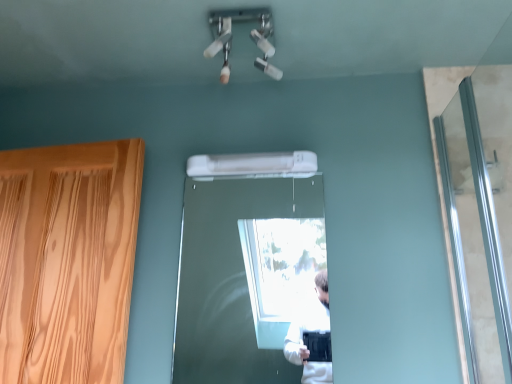
The image size is (512, 384). In order to click on silver metallic screen door at right in this screenshot , I will do `click(481, 215)`.

What do you see at coordinates (244, 275) in the screenshot? Image resolution: width=512 pixels, height=384 pixels. I see `wooden door at center` at bounding box center [244, 275].

What is the approximate height of white plastic air conditioner at center?

3.95 inches.

You are a GUI agent. You are given a task and a screenshot of the screen. Output one action in this format:
    pyautogui.click(x=<x>, y=<y>)
    Task: Click on the white plastic air conditioner at center
    The width and height of the screenshot is (512, 384).
    Given the screenshot: What is the action you would take?
    pyautogui.click(x=253, y=165)

The image size is (512, 384). In order to click on silver metallic screen door at right in this screenshot , I will do `click(481, 215)`.

Find the location of a particular element. The width and height of the screenshot is (512, 384). air conditioner above the silver metallic screen door at right (from the image's perspective) is located at coordinates (253, 165).

Is silver metallic screen door at right to the left of white plastic air conditioner at center from the viewer's perspective?

In fact, silver metallic screen door at right is to the right of white plastic air conditioner at center.

Does point (482, 123) come in front of point (282, 174)?

Yes, it is.

Can you confirm if silver metallic screen door at right is shorter than white plastic air conditioner at center?

Incorrect, the height of silver metallic screen door at right does not fall short of that of white plastic air conditioner at center.

Consider the image. How many degrees apart are the facing directions of white plastic air conditioner at center and silver metallic screen door at right?

There is a 88.9-degree angle between the facing directions of white plastic air conditioner at center and silver metallic screen door at right.

Consider the image. Which is correct: white plastic air conditioner at center is inside silver metallic screen door at right, or outside of it?

white plastic air conditioner at center is outside silver metallic screen door at right.

How distant is white plastic air conditioner at center from silver metallic screen door at right?

white plastic air conditioner at center is 25.09 inches away from silver metallic screen door at right.

Considering the relative sizes of white plastic air conditioner at center and silver metallic screen door at right in the image provided, is white plastic air conditioner at center thinner than silver metallic screen door at right?

No.

Is point (273, 201) less distant than point (202, 162)?

No, it is behind (202, 162).

Considering their positions, is wooden door at center located in front of or behind white plastic air conditioner at center?

Clearly, wooden door at center is in front of white plastic air conditioner at center.

Is wooden door at center facing away from white plastic air conditioner at center?

No, wooden door at center is not facing the opposite direction of white plastic air conditioner at center.

Can you confirm if wooden door at center is positioned to the right of white plastic air conditioner at center?

Yes, wooden door at center is to the right of white plastic air conditioner at center.

Is silver metallic screen door at right facing towards wooden door at center?

Yes, silver metallic screen door at right is facing wooden door at center.

From a real-world perspective, is silver metallic screen door at right physically above wooden door at center?

Correct, in the physical world, silver metallic screen door at right is higher than wooden door at center.

The width and height of the screenshot is (512, 384). I want to click on screen door positioned vertically above the wooden door at center (from a real-world perspective), so click(x=481, y=215).

Is silver metallic screen door at right wider than wooden door at center?

Indeed, silver metallic screen door at right has a greater width compared to wooden door at center.

Considering the positions of points (263, 166) and (255, 358), is point (263, 166) farther from camera compared to point (255, 358)?

No, it is in front of (255, 358).

From the image's perspective, between white plastic air conditioner at center and wooden door at center, which one is located above?

white plastic air conditioner at center is shown above in the image.

Looking at the image, does white plastic air conditioner at center seem bigger or smaller compared to wooden door at center?

Clearly, white plastic air conditioner at center is smaller in size than wooden door at center.

In terms of width, does white plastic air conditioner at center look wider or thinner when compared to wooden door at center?

white plastic air conditioner at center is wider than wooden door at center.

Is point (180, 257) less distant than point (449, 189)?

No, (180, 257) is behind (449, 189).

Where is `door directly beneath the silver metallic screen door at right (from a real-world perspective)`? The image size is (512, 384). door directly beneath the silver metallic screen door at right (from a real-world perspective) is located at coordinates (244, 275).

Is wooden door at center wider or thinner than silver metallic screen door at right?

wooden door at center is thinner than silver metallic screen door at right.

From a real-world perspective, is wooden door at center positioned above or below silver metallic screen door at right?

wooden door at center is situated lower than silver metallic screen door at right in the real world.

Locate an element on the screen. The image size is (512, 384). screen door below the white plastic air conditioner at center (from the image's perspective) is located at coordinates (481, 215).

Where is `air conditioner above the silver metallic screen door at right (from the image's perspective)`? The image size is (512, 384). air conditioner above the silver metallic screen door at right (from the image's perspective) is located at coordinates (253, 165).

Based on their spatial positions, is white plastic air conditioner at center or silver metallic screen door at right further from wooden door at center?

Among the two, silver metallic screen door at right is located further to wooden door at center.

Looking at the image, which one is located closer to silver metallic screen door at right, white plastic air conditioner at center or wooden door at center?

The object closer to silver metallic screen door at right is white plastic air conditioner at center.

From the image, which object appears to be nearer to white plastic air conditioner at center, silver metallic screen door at right or wooden door at center?

silver metallic screen door at right lies closer to white plastic air conditioner at center than the other object.

Looking at the image, which one is located further to wooden door at center, silver metallic screen door at right or white plastic air conditioner at center?

Among the two, silver metallic screen door at right is located further to wooden door at center.

Looking at this image, looking at the image, which one is located further to white plastic air conditioner at center, wooden door at center or silver metallic screen door at right?

wooden door at center is further to white plastic air conditioner at center.

From the image, which object appears to be nearer to silver metallic screen door at right, wooden door at center or white plastic air conditioner at center?

white plastic air conditioner at center.

The height and width of the screenshot is (384, 512). What are the coordinates of `door between white plastic air conditioner at center and silver metallic screen door at right from left to right` in the screenshot? It's located at (244, 275).